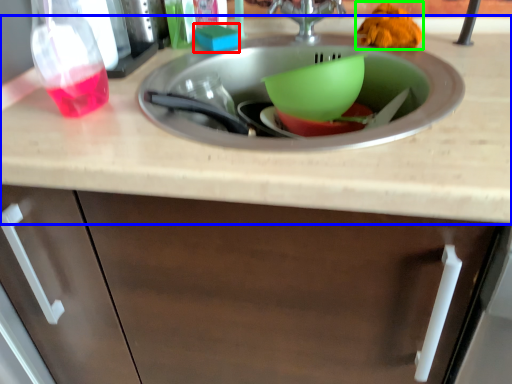
Question: Which is nearer to the food (highlighted by a red box)? countertop (highlighted by a blue box) or food (highlighted by a green box).

Choices:
 (A) countertop
 (B) food

Answer: (B)